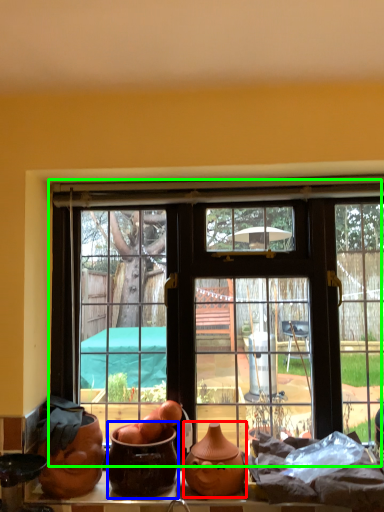
Question: Which object is positioned farthest from pottery (highlighted by a red box)? Select from pottery (highlighted by a blue box) and window (highlighted by a green box).

Choices:
 (A) pottery
 (B) window

Answer: (B)